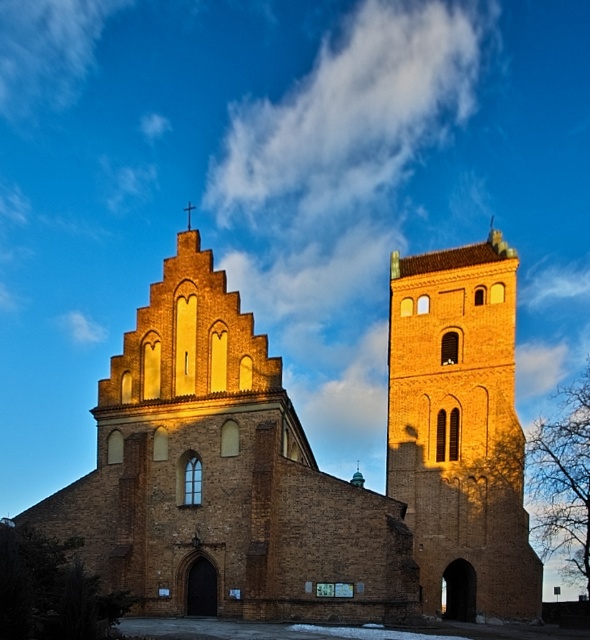
Between brown brick church at center and brown brick tower at center, which one has more height?

brown brick tower at center is taller.

Identify the location of brown brick church at center. (309, 460).

Who is more distant from viewer, (457, 484) or (506, 424)?

Positioned behind is point (506, 424).

Locate an element on the screen. The height and width of the screenshot is (640, 590). brown brick church at center is located at coordinates (309, 460).